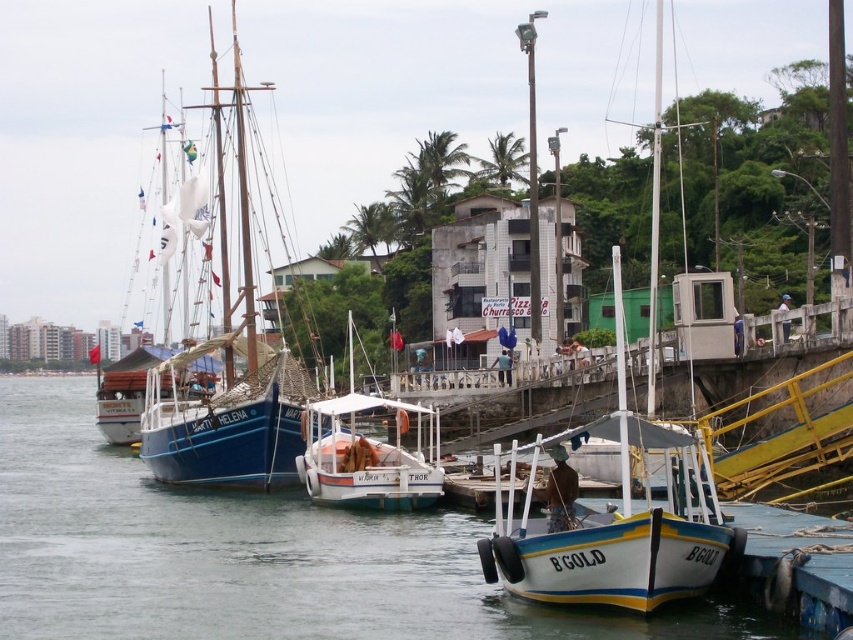
Question: Does blue wooden sailboat at left have a lesser width compared to white matte boat at center?

Choices:
 (A) yes
 (B) no

Answer: (B)

Question: Can you confirm if clear water at boat right is bigger than blue wooden sailboat at left?

Choices:
 (A) no
 (B) yes

Answer: (A)

Question: Can you confirm if white matte sailboat at center is positioned below white matte boat at center?

Choices:
 (A) yes
 (B) no

Answer: (B)

Question: Which object appears closest to the camera in this image?

Choices:
 (A) white matte sailboat at center
 (B) blue wooden sailboat at left
 (C) white matte boat at center
 (D) clear water at boat right

Answer: (D)

Question: Among these points, which one is farthest from the camera?

Choices:
 (A) (228, 477)
 (B) (495, 461)

Answer: (A)

Question: Which point is farther from the camera taking this photo?

Choices:
 (A) (238, 449)
 (B) (397, 420)
 (C) (22, 516)

Answer: (A)